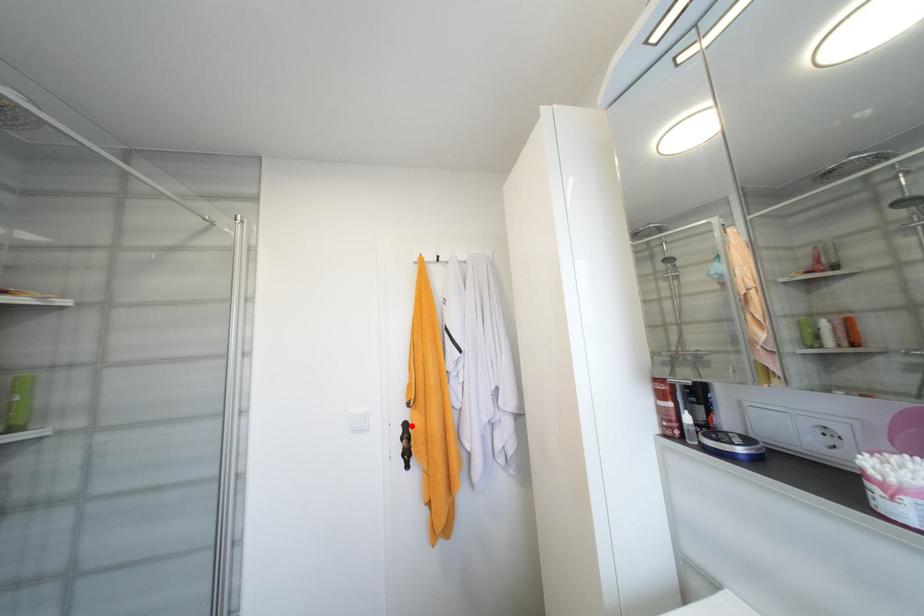
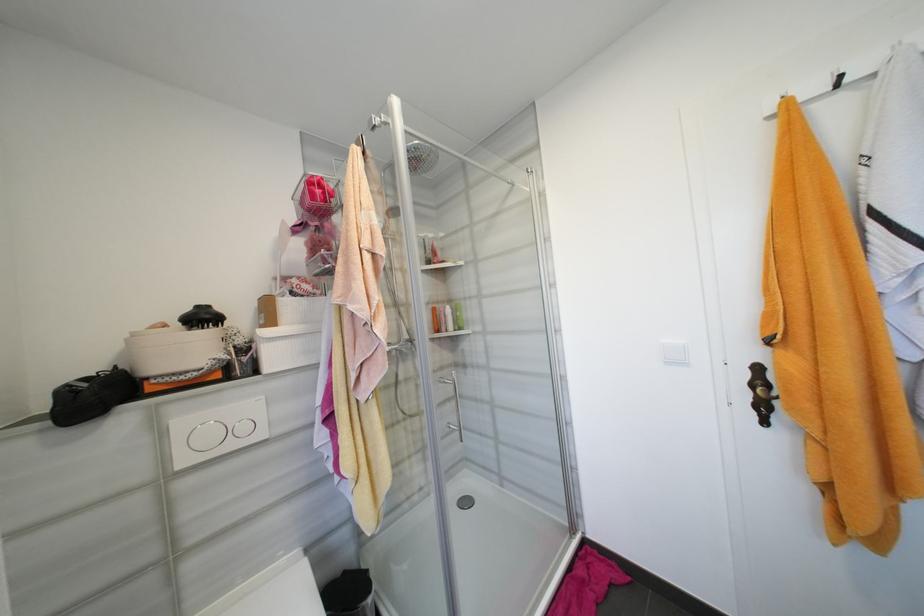
Find the pixel in the second image that matches the highlighted location in the first image.

(763, 370)